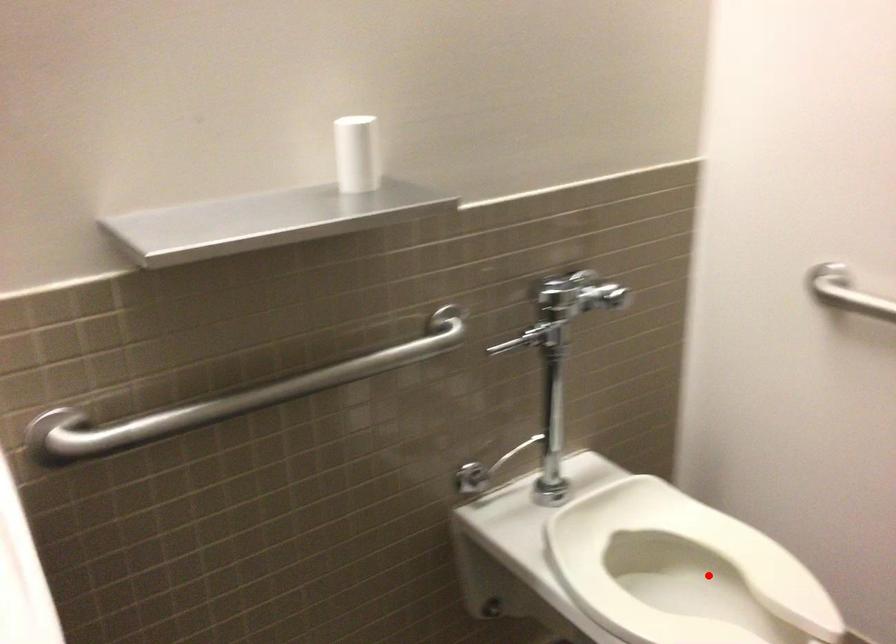
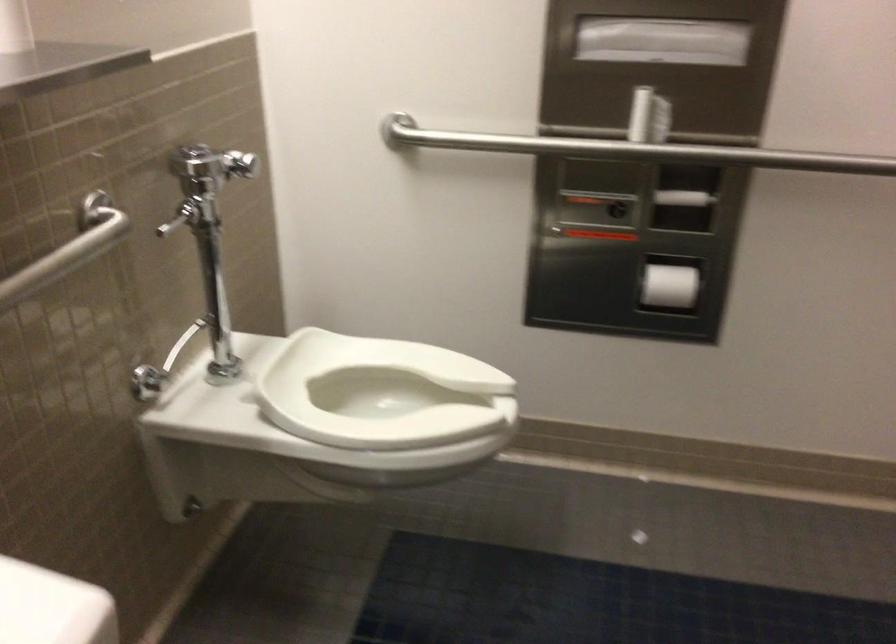
Question: I am providing you with two images of the same scene from different viewpoints. In image1, a red point is highlighted. Considering the same 3D point in image2, which of the following is correct?

Choices:
 (A) It is closer
 (B) It is farther

Answer: (B)